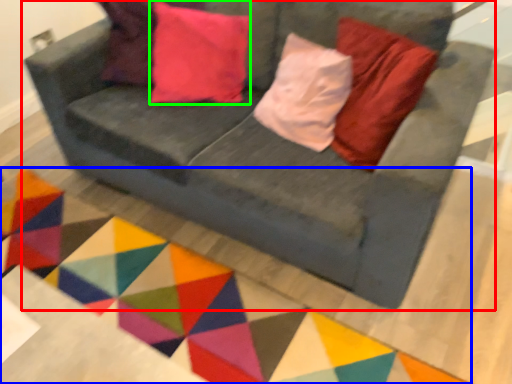
Question: Considering the real-world distances, which object is farthest from studio couch (highlighted by a red box)? mat (highlighted by a blue box) or pillow (highlighted by a green box)?

Choices:
 (A) mat
 (B) pillow

Answer: (A)